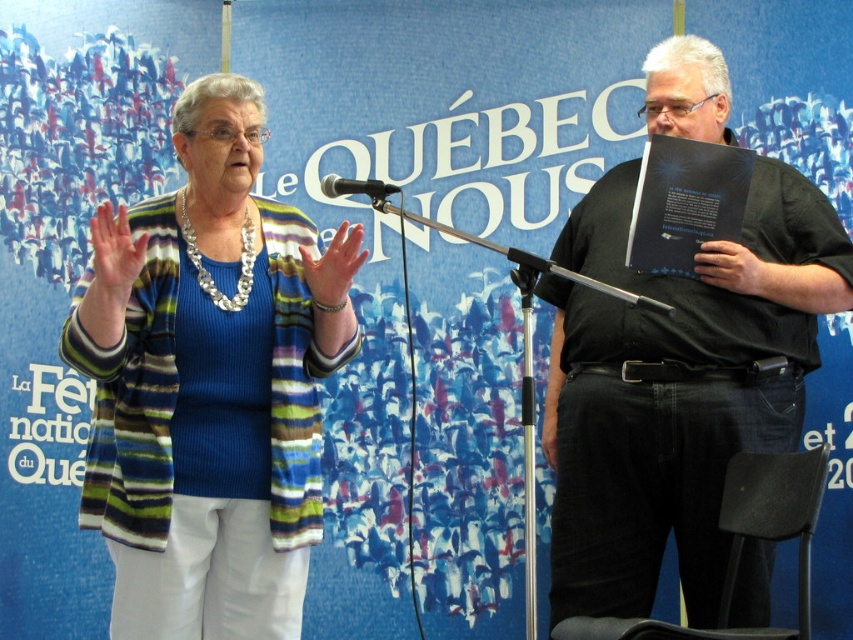
Is matte green sweater at upper left below black plastic microphone at center?

Yes, matte green sweater at upper left is below black plastic microphone at center.

Between matte green sweater at upper left and black plastic microphone at center, which one appears on the right side from the viewer's perspective?

black plastic microphone at center

Is point (99, 301) closer to viewer compared to point (331, 180)?

Yes, it is.

At what (x,y) coordinates should I click in order to perform the action: click on matte green sweater at upper left. Please return your answer as a coordinate pair (x, y). Looking at the image, I should click on (114, 256).

Between striped knit cardigan at center and matte green sweater at upper left, which one is positioned higher?

Positioned higher is matte green sweater at upper left.

Locate an element on the screen. The height and width of the screenshot is (640, 853). striped knit cardigan at center is located at coordinates (209, 394).

I want to click on striped knit cardigan at center, so click(x=209, y=394).

Between point (262, 330) and point (321, 268), which one is positioned in front?

Positioned in front is point (321, 268).

You are a GUI agent. You are given a task and a screenshot of the screen. Output one action in this format:
    pyautogui.click(x=<x>, y=<y>)
    Task: Click on the striped knit cardigan at center
    
    Given the screenshot: What is the action you would take?
    pyautogui.click(x=209, y=394)